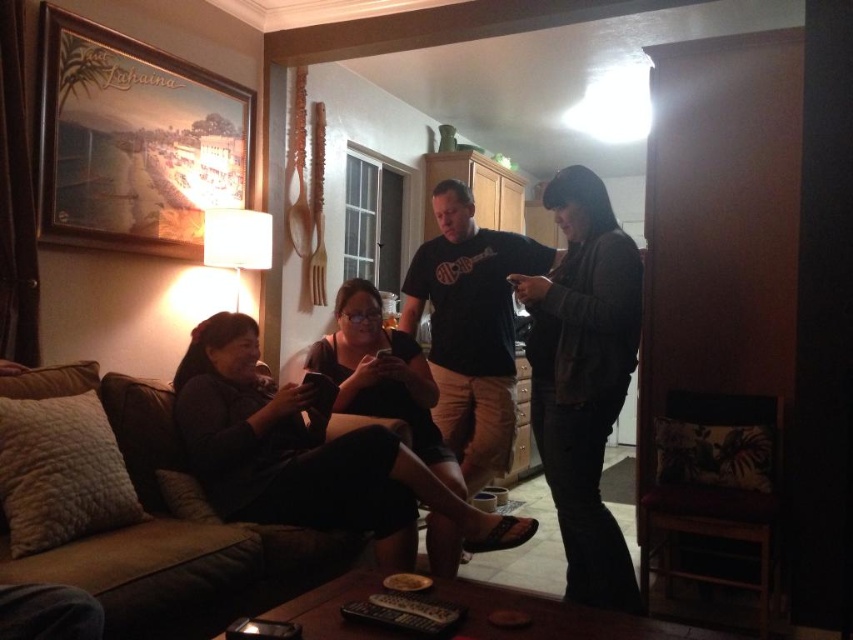
Question: Does dark gray fabric couch at lower left lie behind brown fabric couch at lower left?

Choices:
 (A) no
 (B) yes

Answer: (B)

Question: Is the position of dark gray sweater at center more distant than that of black cotton t-shirt at center?

Choices:
 (A) yes
 (B) no

Answer: (B)

Question: Based on their relative distances, which object is farther from the brown fabric couch at lower left?

Choices:
 (A) dark gray sweater at center
 (B) black cotton t-shirt at center

Answer: (A)

Question: Can you confirm if dark gray fabric couch at lower left is positioned above brown fabric couch at lower left?

Choices:
 (A) yes
 (B) no

Answer: (A)

Question: Which point is closer to the camera?

Choices:
 (A) (39, 561)
 (B) (233, 362)

Answer: (A)

Question: Among these points, which one is farthest from the camera?

Choices:
 (A) (618, 400)
 (B) (247, 355)
 (C) (508, 353)
 (D) (285, 572)

Answer: (C)